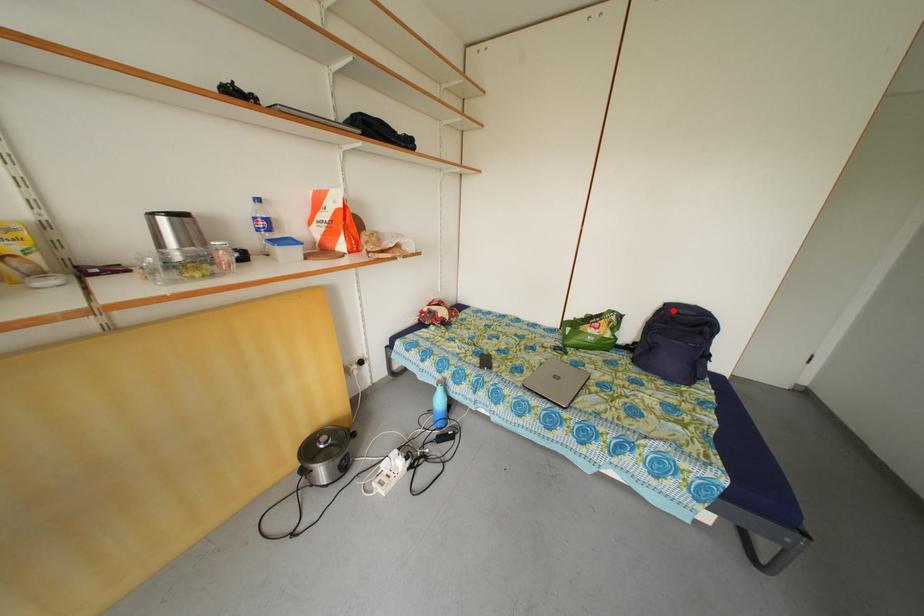
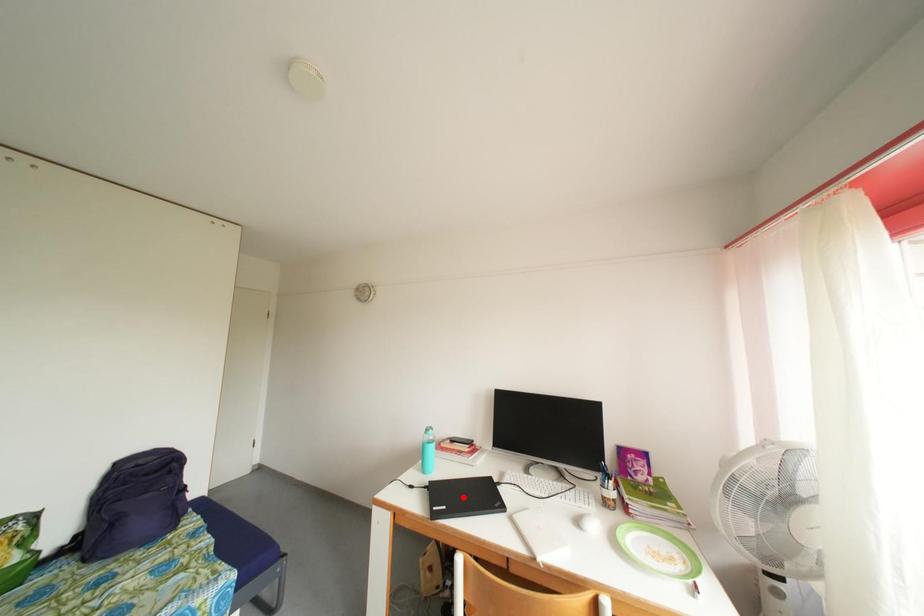
I am providing you with two images of the same scene from different viewpoints. A red point is marked on the first image and another point is marked on the second image. Do the highlighted points in image1 and image2 indicate the same real-world spot?

No